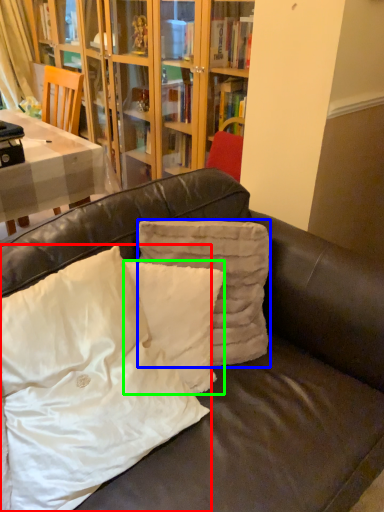
Question: Which object is positioned farthest from pillow (highlighted by a red box)? Select from pillow (highlighted by a blue box) and pillow (highlighted by a green box).

Choices:
 (A) pillow
 (B) pillow

Answer: (A)